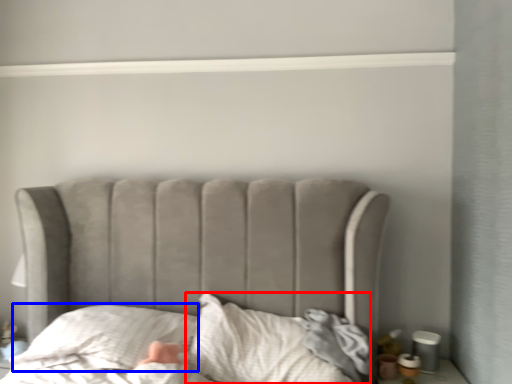
Question: Which object appears farthest to the camera in this image, sheet (highlighted by a red box) or throw pillow (highlighted by a blue box)?

Choices:
 (A) sheet
 (B) throw pillow

Answer: (B)